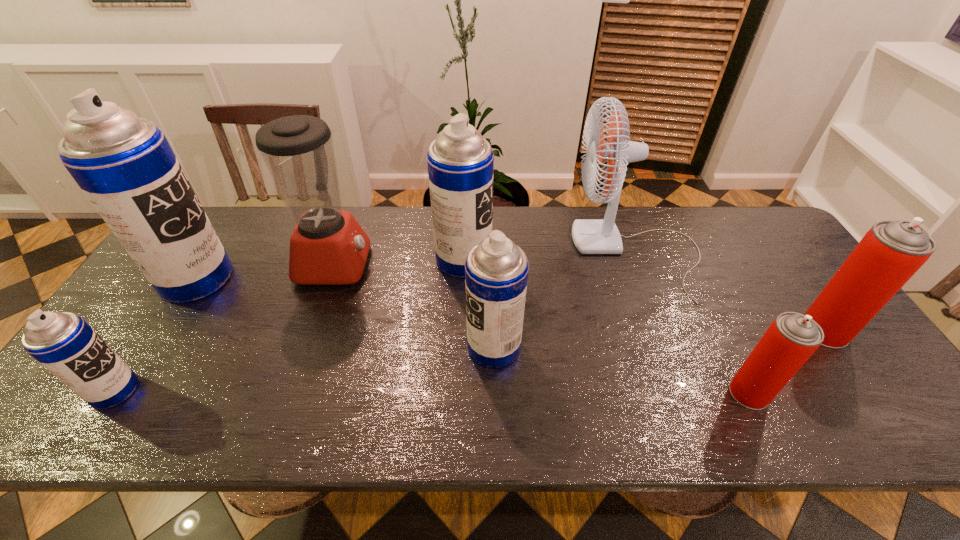
Image resolution: width=960 pixels, height=540 pixels. Identify the location of free space located on the label side of the second smallest blue aerosol can. pos(399,347).

You are a GUI agent. You are given a task and a screenshot of the screen. Output one action in this format:
    pyautogui.click(x=<x>, y=<y>)
    Task: Click on the free spot located 0.220m on the right of the left red aerosol can
    
    Given the screenshot: What is the action you would take?
    pyautogui.click(x=864, y=393)

Find the location of a particular element. The width and height of the screenshot is (960, 540). free space located 0.330m on the label side of the smallest blue aerosol can is located at coordinates (280, 390).

Where is `aerosol can that is at the far edge`? The height and width of the screenshot is (540, 960). aerosol can that is at the far edge is located at coordinates (460, 162).

Where is `fan that is at the far edge`? fan that is at the far edge is located at coordinates (591, 236).

Identify the location of blender that is at the far edge. (328, 246).

Find the location of a particular element. This screenshot has height=540, width=960. object that is at the right edge is located at coordinates [x=891, y=252].

Where is `object present at the near left corner`? This screenshot has width=960, height=540. object present at the near left corner is located at coordinates (64, 343).

The height and width of the screenshot is (540, 960). Find the location of `vacant space at the far edge`. vacant space at the far edge is located at coordinates (596, 254).

Where is `free space at the near edge of the desktop`? This screenshot has width=960, height=540. free space at the near edge of the desktop is located at coordinates (595, 415).